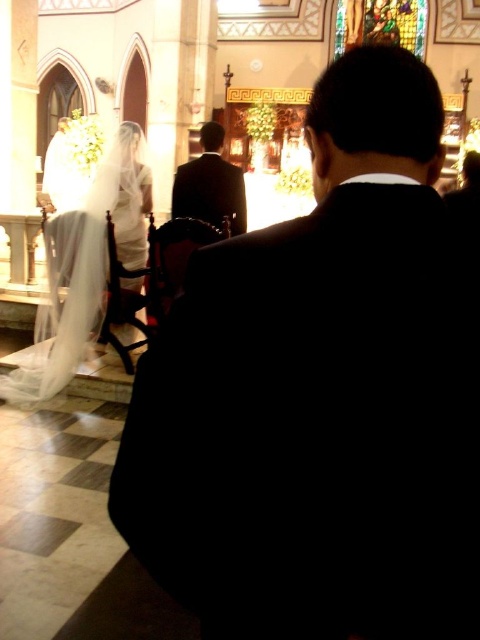
Looking at this image, which is more to the left, white sheer veil at upper left or dark suit at center?

Positioned to the left is white sheer veil at upper left.

Between white sheer veil at upper left and dark suit at center, which one is positioned lower?

white sheer veil at upper left

Identify the location of white sheer veil at upper left. The width and height of the screenshot is (480, 640). (84, 266).

Does black suit at center have a greater height compared to white sheer veil at upper left?

Indeed, black suit at center has a greater height compared to white sheer veil at upper left.

Identify the location of black suit at center. (322, 394).

Between point (212, 284) and point (214, 148), which one is positioned in front?

Point (212, 284) is in front.

What do you see at coordinates (322, 394) in the screenshot?
I see `black suit at center` at bounding box center [322, 394].

Identify the location of black suit at center. This screenshot has width=480, height=640. (322, 394).

Identify the location of black suit at center. (322, 394).